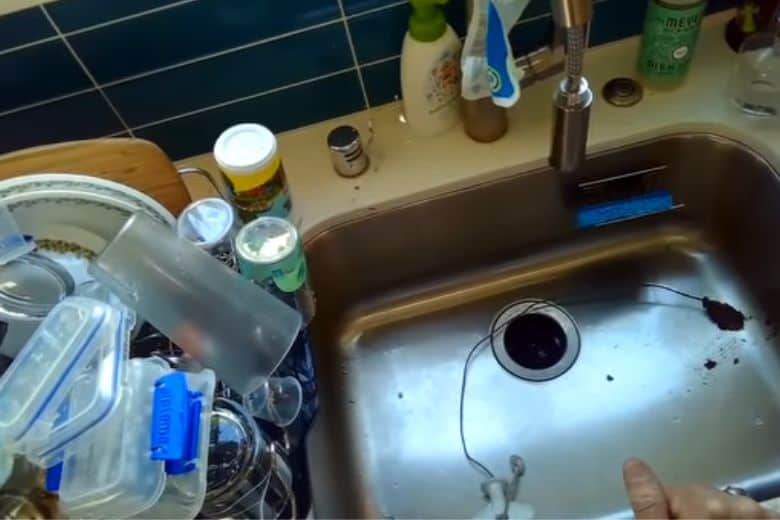
Identify the location of sink. (438, 407).